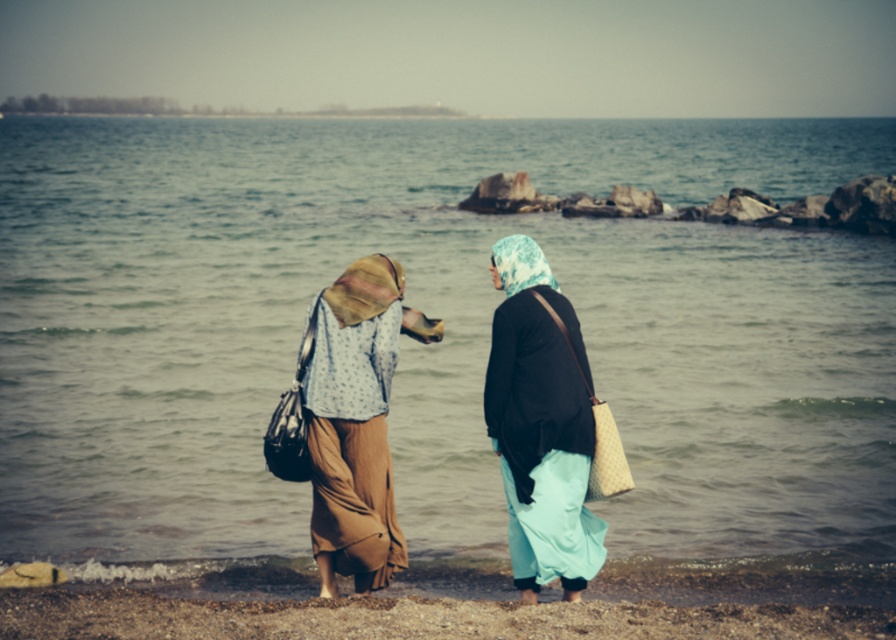
Which is above, light blue printed hijab at center or brown textured skirt at center?

Positioned higher is light blue printed hijab at center.

Does light blue printed hijab at center appear over brown textured skirt at center?

Correct, light blue printed hijab at center is located above brown textured skirt at center.

At what (x,y) coordinates should I click in order to perform the action: click on light blue printed hijab at center. Please return your answer as a coordinate pair (x, y). The width and height of the screenshot is (896, 640). Looking at the image, I should click on (540, 426).

Does point (780, 202) lie behind point (377, 285)?

Yes, point (780, 202) is behind point (377, 285).

Who is taller, greenish-blue water at center or brown textured skirt at center?

With more height is greenish-blue water at center.

What do you see at coordinates (444, 328) in the screenshot?
I see `greenish-blue water at center` at bounding box center [444, 328].

Identify the location of greenish-blue water at center. (444, 328).

Is greenish-blue water at center positioned behind light blue printed hijab at center?

Yes, greenish-blue water at center is further from the viewer.

Between point (632, 428) and point (521, 586), which one is positioned in front?

Point (521, 586)

Find the location of a particular element. Image resolution: width=896 pixels, height=640 pixels. greenish-blue water at center is located at coordinates (444, 328).